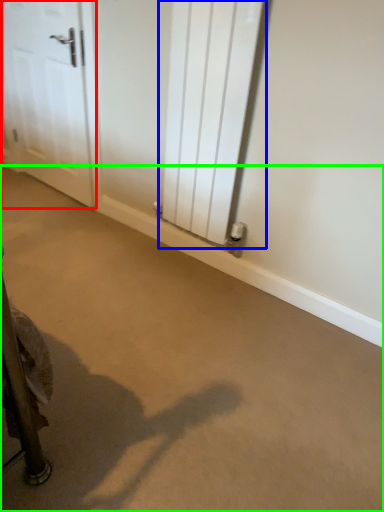
Question: Considering the real-world distances, which object is farthest from door (highlighted by a red box)? radiator (highlighted by a blue box) or concrete (highlighted by a green box)?

Choices:
 (A) radiator
 (B) concrete

Answer: (B)